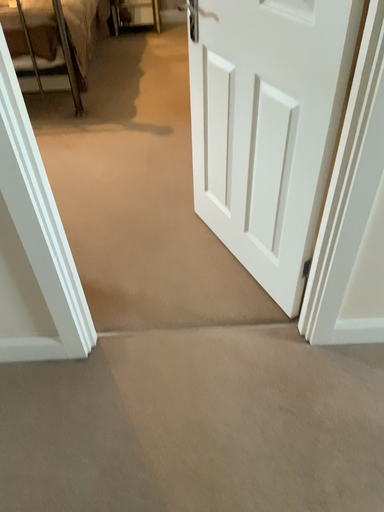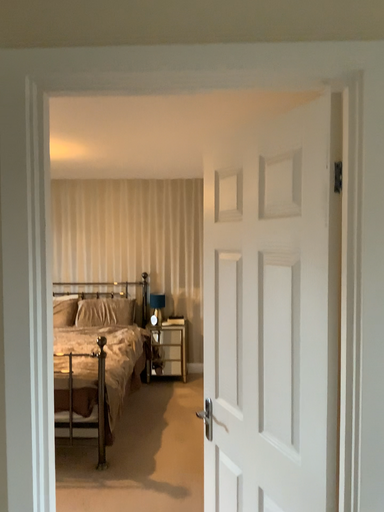
Question: How did the camera likely rotate when shooting the video?

Choices:
 (A) rotated downward
 (B) rotated upward

Answer: (B)